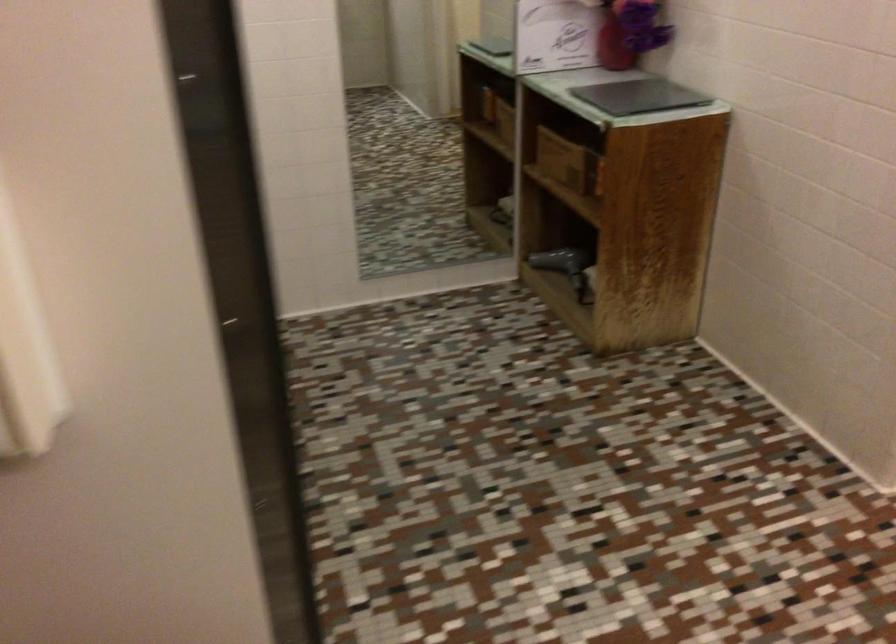
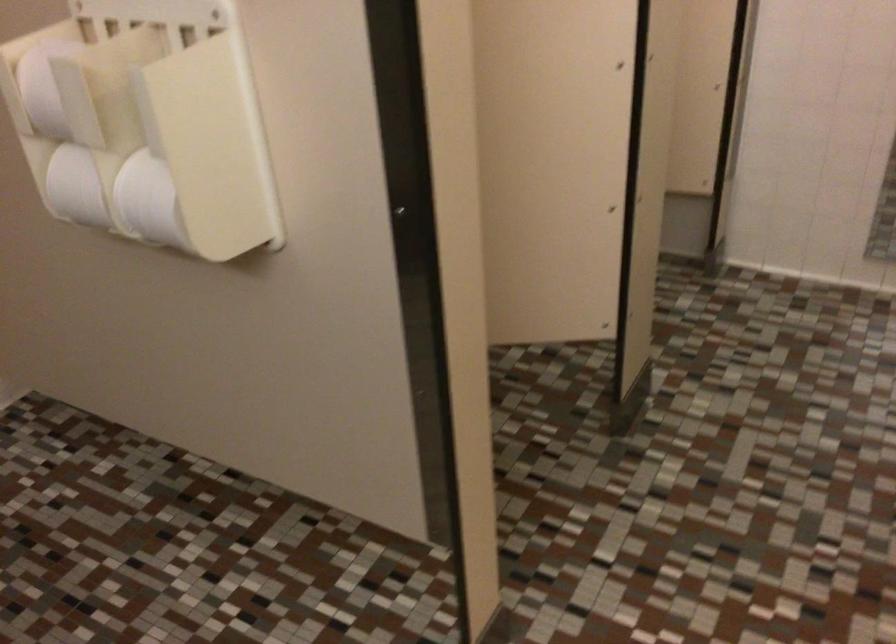
Question: The camera is either moving clockwise (left) or counter-clockwise (right) around the object. The first image is from the beginning of the video and the second image is from the end. Is the camera moving left or right when shooting the video?

Choices:
 (A) Left
 (B) Right

Answer: (B)